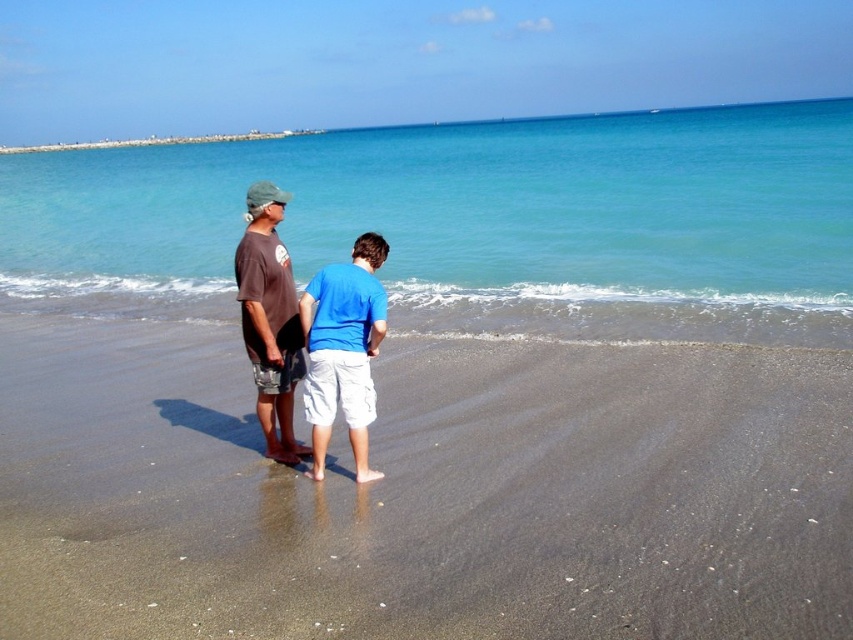
Question: Among these points, which one is nearest to the camera?

Choices:
 (A) (352, 291)
 (B) (155, 368)
 (C) (451, 145)

Answer: (A)

Question: Is blue cotton shirt at center smaller than brown cotton t-shirt at center?

Choices:
 (A) yes
 (B) no

Answer: (A)

Question: Estimate the real-world distances between objects in this image. Which object is farther from the blue cotton shirt at center?

Choices:
 (A) dark brown sand at lower center
 (B) brown cotton t-shirt at center
 (C) clear blue water at center

Answer: (C)

Question: Is blue cotton shirt at center closer to camera compared to brown cotton t-shirt at center?

Choices:
 (A) no
 (B) yes

Answer: (B)

Question: Does clear blue water at center have a smaller size compared to brown cotton t-shirt at center?

Choices:
 (A) yes
 (B) no

Answer: (B)

Question: Based on their relative distances, which object is farther from the dark brown sand at lower center?

Choices:
 (A) clear blue water at center
 (B) blue cotton shirt at center

Answer: (A)